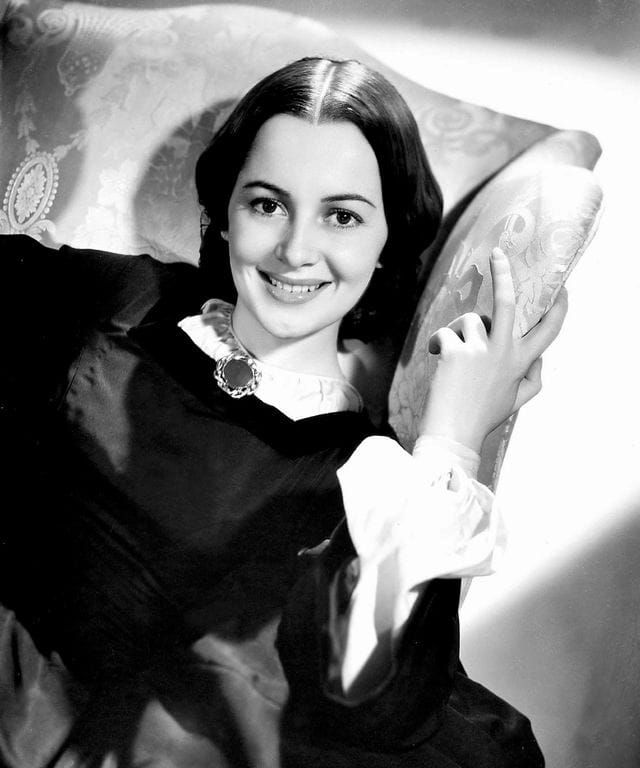
You are a GUI agent. You are given a task and a screenshot of the screen. Output one action in this format:
    pyautogui.click(x=<x>, y=<y>)
    Task: Click on the chair
    The height and width of the screenshot is (768, 640).
    Given the screenshot: What is the action you would take?
    click(132, 106)